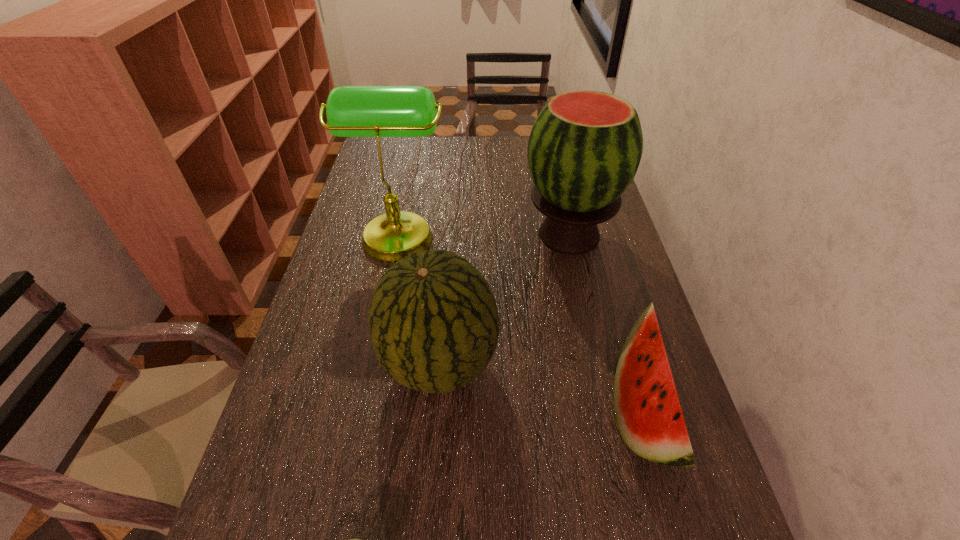
This screenshot has height=540, width=960. In order to click on object that is the third closest one to the third tallest object in this screenshot , I will do `click(647, 410)`.

You are a GUI agent. You are given a task and a screenshot of the screen. Output one action in this format:
    pyautogui.click(x=<x>, y=<y>)
    Task: Click on the third closest watermelon to the mug
    This screenshot has height=540, width=960.
    Given the screenshot: What is the action you would take?
    pyautogui.click(x=585, y=147)

What are the coordinates of `watermelon that is the second nearest to the farthest watermelon` in the screenshot? It's located at (647, 410).

I want to click on blank space that satisfies the following two spatial constraints: 1. on the desk next to the second shortest watermelon; 2. on the left side of the lamp, so [372, 364].

The width and height of the screenshot is (960, 540). What are the coordinates of `free space that satisfies the following two spatial constraints: 1. on the back side of the third shortest object; 2. on the desk next to the lamp` in the screenshot? It's located at (449, 233).